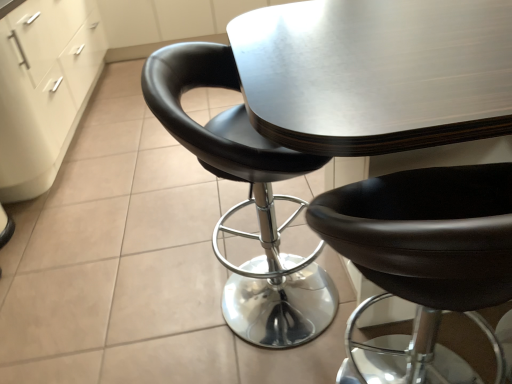
Question: Visually, is white matte file cabinet at lower left positioned to the left or to the right of black leather chair at center, which is the 1th chair from left to right?

Choices:
 (A) right
 (B) left

Answer: (B)

Question: From the image's perspective, is white matte file cabinet at lower left positioned above or below black leather chair at center, which is the 2th chair from right to left?

Choices:
 (A) below
 (B) above

Answer: (B)

Question: Which of these objects is positioned farthest from the white matte file cabinet at lower left?

Choices:
 (A) black leather chair at center, which is the 1th chair from left to right
 (B) black leather chair at center, the first chair in the right-to-left sequence

Answer: (B)

Question: Which object is positioned closest to the black leather chair at center, the first chair in the right-to-left sequence?

Choices:
 (A) white matte file cabinet at lower left
 (B) black leather chair at center, which is the 2th chair from right to left

Answer: (B)